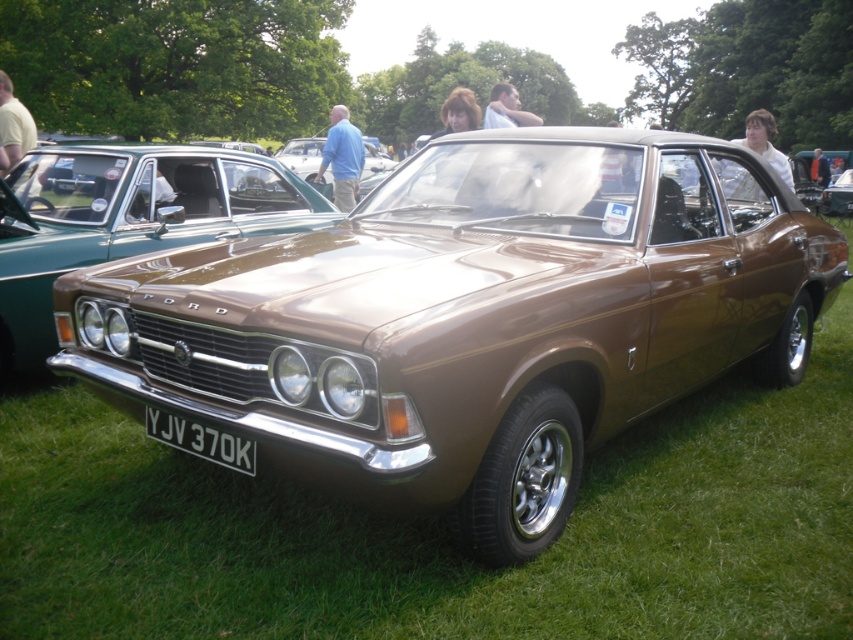
Describe the element at coordinates (471, 317) in the screenshot. I see `shiny brown car at center` at that location.

Is point (300, 420) in front of point (33, 326)?

Yes, point (300, 420) is in front of point (33, 326).

This screenshot has height=640, width=853. Describe the element at coordinates (471, 317) in the screenshot. I see `shiny brown car at center` at that location.

Locate an element on the screen. The height and width of the screenshot is (640, 853). shiny brown car at center is located at coordinates (471, 317).

Can you confirm if shiny brown car at center is positioned to the left of white plastic license plate at center?

Incorrect, shiny brown car at center is not on the left side of white plastic license plate at center.

Between point (349, 470) and point (248, 467), which one is positioned in front?

Point (349, 470) is in front.

The image size is (853, 640). In order to click on shiny brown car at center in this screenshot , I will do `click(471, 317)`.

Is brown metallic car at center positioned before white plastic license plate at center?

No, brown metallic car at center is behind white plastic license plate at center.

Consider the image. Is brown metallic car at center below white plastic license plate at center?

No, brown metallic car at center is not below white plastic license plate at center.

The width and height of the screenshot is (853, 640). I want to click on brown metallic car at center, so click(128, 220).